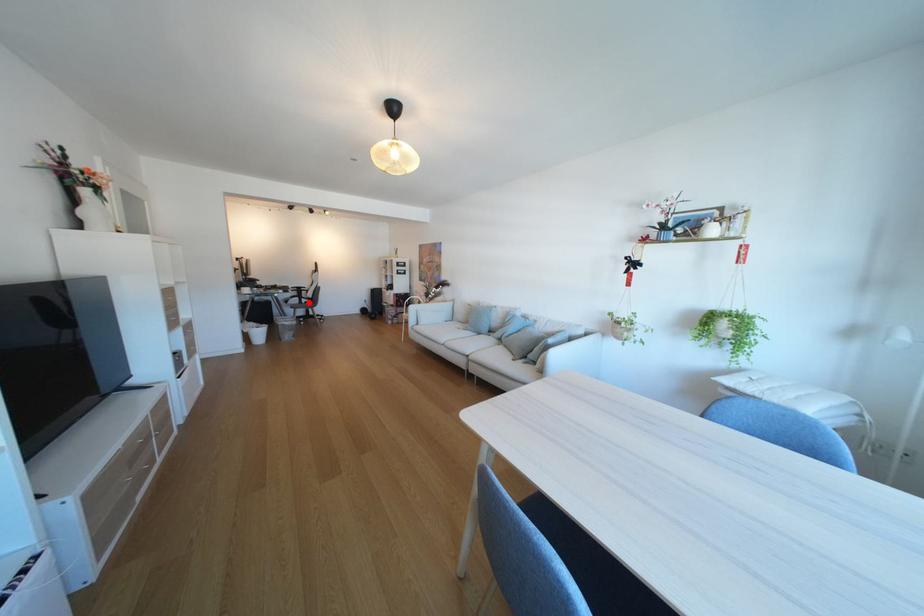
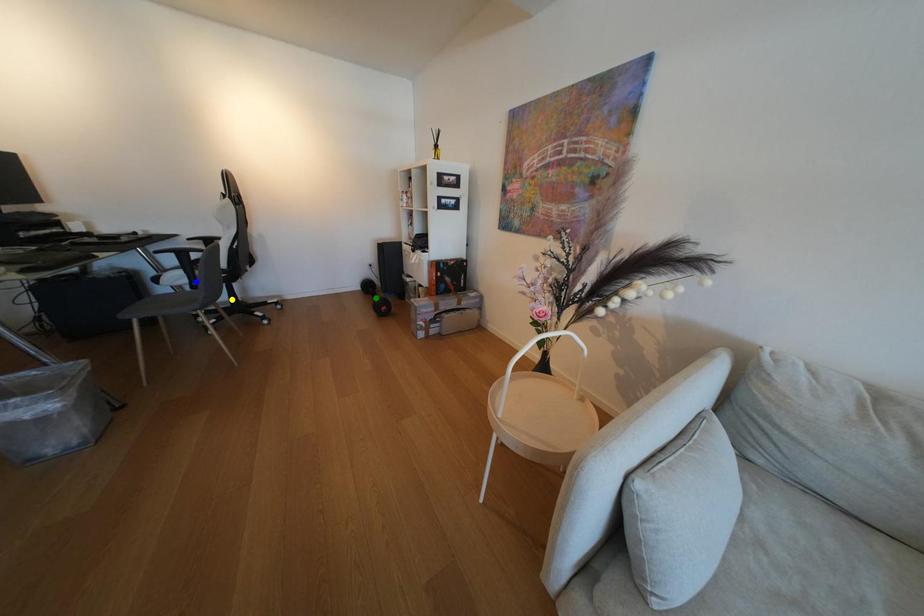
Question: I am providing you with two images of the same scene from different viewpoints. A red point is marked on the first image. You are given multiple points on the second image. Can you choose the point in image 2 that corresponds to the point in image 1?

Choices:
 (A) green point
 (B) blue point
 (C) yellow point

Answer: (B)